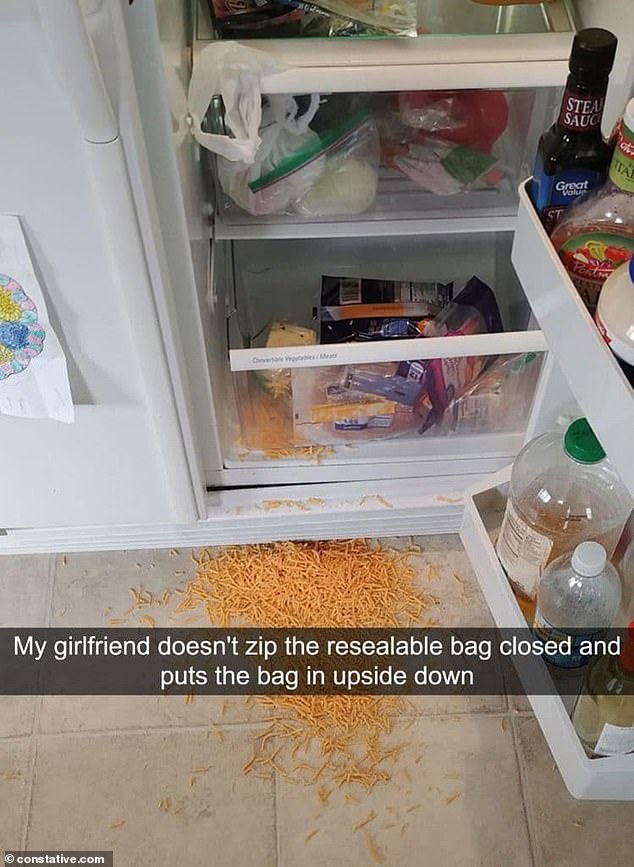
The image size is (634, 867). Identify the location of cheese drawer. (390, 327).